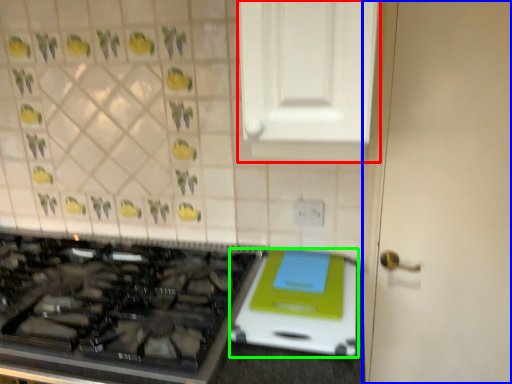
Question: Considering the real-world distances, which object is farthest from cabinetry (highlighted by a red box)? door (highlighted by a blue box) or appliance (highlighted by a green box)?

Choices:
 (A) door
 (B) appliance

Answer: (B)